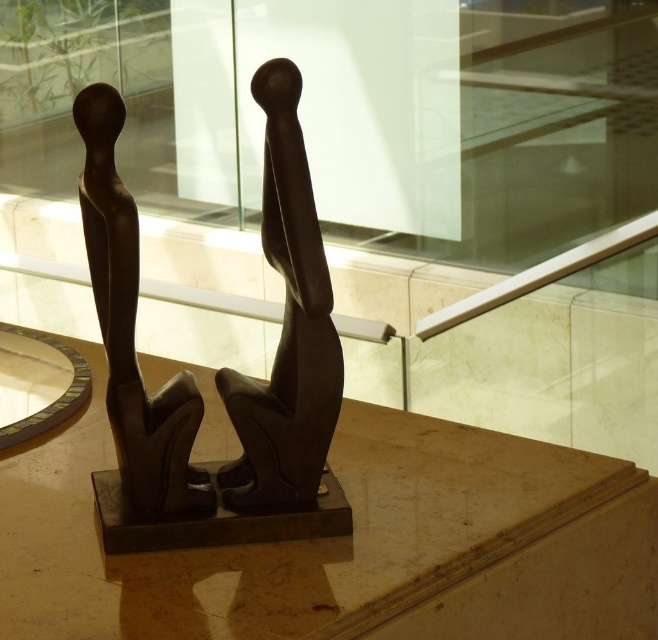
Question: Which point is farther to the camera?

Choices:
 (A) (276, 125)
 (B) (122, 528)

Answer: (B)

Question: Observing the image, what is the correct spatial positioning of matte bronze sculpture at center in reference to matte black sculpture at center?

Choices:
 (A) above
 (B) below

Answer: (B)

Question: Does matte bronze sculpture at center appear on the right side of matte black sculpture at center?

Choices:
 (A) no
 (B) yes

Answer: (A)

Question: Based on their relative distances, which object is nearer to the matte black sculpture at center?

Choices:
 (A) matte bronze sculpture at center
 (B) matte bronze sculpture at left

Answer: (A)

Question: Which point is closer to the camera?

Choices:
 (A) pyautogui.click(x=128, y=481)
 (B) pyautogui.click(x=114, y=104)
 (C) pyautogui.click(x=288, y=355)

Answer: (B)

Question: Does matte bronze sculpture at center appear under matte black sculpture at center?

Choices:
 (A) no
 (B) yes

Answer: (B)